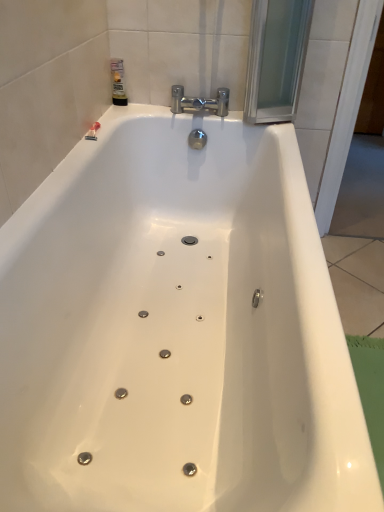
Question: From the image's perspective, is translucent plastic bottle at upper left positioned above or below chrome/metallic faucet at upper center?

Choices:
 (A) below
 (B) above

Answer: (B)

Question: Is point (114, 76) closer or farther from the camera than point (223, 114)?

Choices:
 (A) farther
 (B) closer

Answer: (B)

Question: From a real-world perspective, is translucent plastic bottle at upper left physically located above or below chrome/metallic faucet at upper center?

Choices:
 (A) above
 (B) below

Answer: (A)

Question: Considering the positions of chrome/metallic faucet at upper center and translucent plastic bottle at upper left in the image, is chrome/metallic faucet at upper center taller or shorter than translucent plastic bottle at upper left?

Choices:
 (A) short
 (B) tall

Answer: (A)

Question: In terms of size, does chrome/metallic faucet at upper center appear bigger or smaller than translucent plastic bottle at upper left?

Choices:
 (A) big
 (B) small

Answer: (A)

Question: In the image, is chrome/metallic faucet at upper center on the left side or the right side of translucent plastic bottle at upper left?

Choices:
 (A) left
 (B) right

Answer: (B)

Question: From the image's perspective, is chrome/metallic faucet at upper center positioned above or below translucent plastic bottle at upper left?

Choices:
 (A) below
 (B) above

Answer: (A)